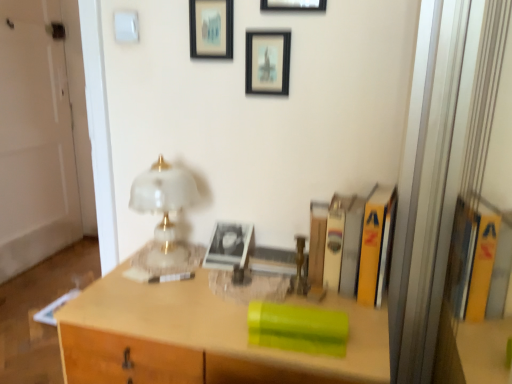
Question: Is yellow hardcover book at right, positioned as the first book in right-to-left order, in front of or behind matte glass table lamp at center in the image?

Choices:
 (A) front
 (B) behind

Answer: (A)

Question: Considering the positions of yellow hardcover book at right, which is counted as the 3th book, starting from the left, and matte glass table lamp at center in the image, is yellow hardcover book at right, which is counted as the 3th book, starting from the left, taller or shorter than matte glass table lamp at center?

Choices:
 (A) short
 (B) tall

Answer: (A)

Question: Which of these objects is positioned farthest from the green plastic container at center, positioned as the first book in left-to-right order?

Choices:
 (A) yellow hardcover book at right, positioned as the first book in right-to-left order
 (B) wooden picture frame at upper center, which is counted as the first picture frame, starting from the right
 (C) hardcover book at center, the 2th book in the right-to-left sequence
 (D) matte glass table lamp at center
 (E) matte black picture frame at upper center, the second picture frame viewed from the left

Answer: (B)

Question: Which of these objects is positioned closest to the hardcover book at center, the 2th book in the right-to-left sequence?

Choices:
 (A) green plastic container at center, marked as the 3th book in a right-to-left arrangement
 (B) yellow hardcover book at right, positioned as the first book in right-to-left order
 (C) matte glass table lamp at center
 (D) matte black picture frame at upper center, the second picture frame viewed from the left
 (E) matte black picture frame at upper center, which is counted as the 3th picture frame, starting from the right

Answer: (B)